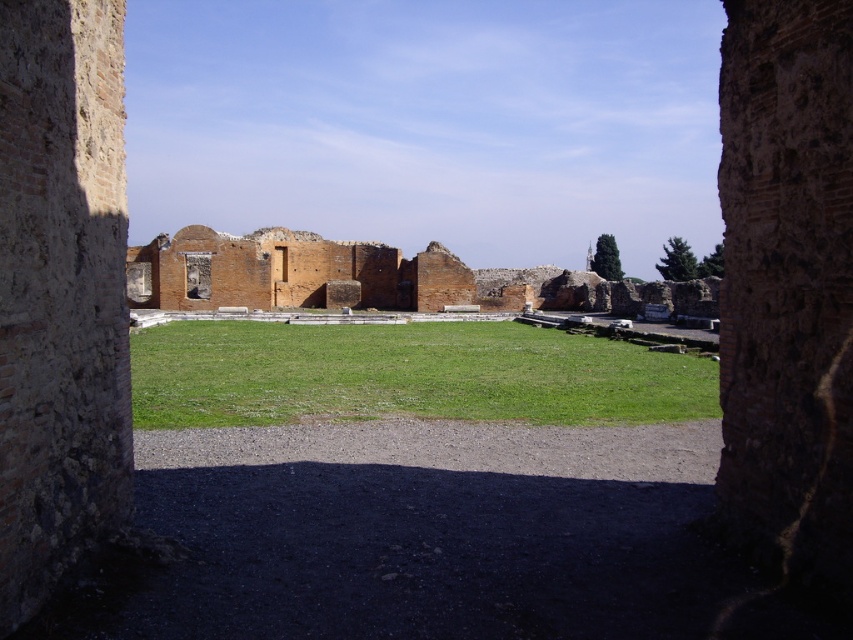
You are an archaeologist standing at the entrance of the stone structure. You need to walk to the brick wall ruins at center to examine it. Can you directly walk straight ahead from your current position without stepping on the green grass at center?

The brick wall ruins at center is behind the green grass at center, so you would have to step on the green grass at center to reach it by walking straight ahead.

You are standing at the entrance of the partially open stone structure in the archaeological site. You need to place a small marker exactly at the center of the green grass at center. According to the coordinates provided, where should you place the marker?

The marker should be placed at the 2D location point of green grass at center, which is at coordinates (405,374).

You are an archaeologist exploring the site and need to walk from the shadowed doorway to the brick wall ruins at center. Which direction should you head relative to the green grass at center?

You should head to the left of the green grass at center because the brick wall ruins at center is to the left of the green grass at center.